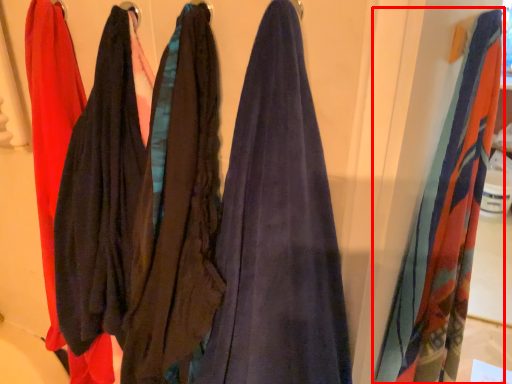
Question: From the image's perspective, what is the correct spatial relationship of towel (annotated by the red box) in relation to clothing?

Choices:
 (A) below
 (B) above

Answer: (A)